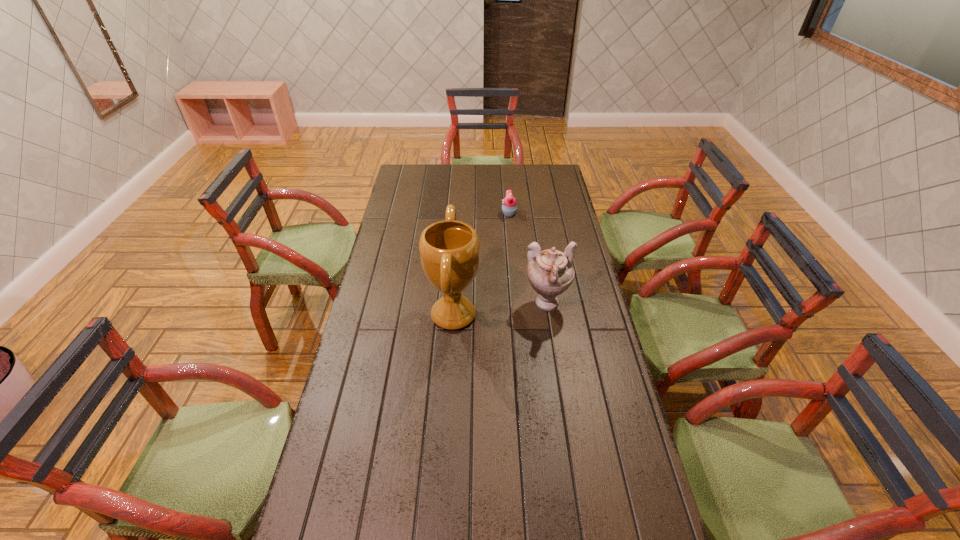
This screenshot has width=960, height=540. Identify the location of the tallest object. (449, 250).

Find the location of a particular element. award is located at coordinates (449, 250).

The height and width of the screenshot is (540, 960). In order to click on the second tallest object in this screenshot , I will do `click(550, 272)`.

In order to click on the farthest object in this screenshot , I will do `click(509, 207)`.

The height and width of the screenshot is (540, 960). Identify the location of the shortest object. (509, 207).

Where is `vacant region located 0.270m on the front of the tallest object with the decoration`? vacant region located 0.270m on the front of the tallest object with the decoration is located at coordinates (557, 315).

At what (x,y) coordinates should I click in order to perform the action: click on free space located on the left of the urn. Please return your answer as a coordinate pair (x, y). Looking at the image, I should click on (424, 305).

Where is `free space located on the face of the farthest object`? The image size is (960, 540). free space located on the face of the farthest object is located at coordinates point(427,213).

Identify the location of vacant position located 0.270m on the face of the farthest object. The width and height of the screenshot is (960, 540). (443, 213).

In order to click on vacant space located on the face of the farthest object in this screenshot , I will do `click(467, 213)`.